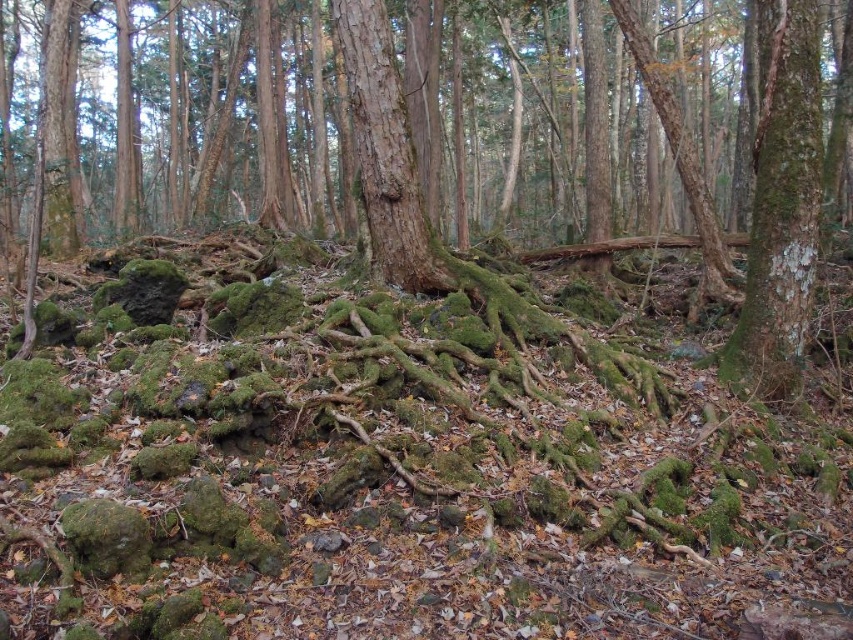
Which is above, green mossy roots at center or green mossy bark tree trunk at right?

green mossy roots at center is above.

Is green mossy roots at center shorter than green mossy bark tree trunk at right?

Incorrect, green mossy roots at center's height does not fall short of green mossy bark tree trunk at right's.

Between point (436, 3) and point (805, 150), which one is positioned behind?

The point (436, 3) is behind.

Identify the location of green mossy roots at center. This screenshot has width=853, height=640. (672, 156).

The width and height of the screenshot is (853, 640). I want to click on green mossy bark tree trunk at right, so point(780,204).

Is green mossy bark tree trunk at right positioned before brown rough tree trunk at center?

Yes, green mossy bark tree trunk at right is in front of brown rough tree trunk at center.

Find the location of a particular element. green mossy bark tree trunk at right is located at coordinates (780, 204).

Identify the location of green mossy bark tree trunk at right. The width and height of the screenshot is (853, 640). (780, 204).

Is the position of green mossy roots at center more distant than that of brown rough tree trunk at center?

→ No.

Which is behind, point (834, 131) or point (367, 44)?

The point (834, 131) is more distant.

At what (x,y) coordinates should I click in order to perform the action: click on green mossy roots at center. Please return your answer as a coordinate pair (x, y). The image size is (853, 640). Looking at the image, I should click on (672, 156).